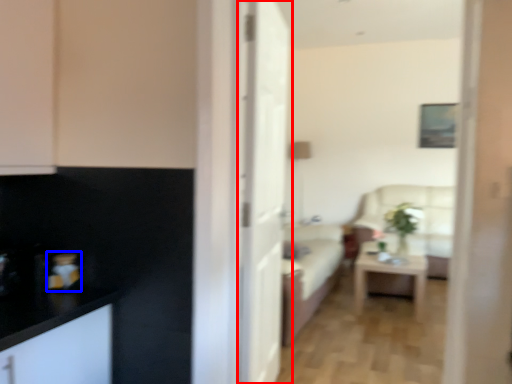
Question: Which point is closer to the camera, door (highlighted by a red box) or appliance (highlighted by a blue box)?

Choices:
 (A) door
 (B) appliance

Answer: (B)